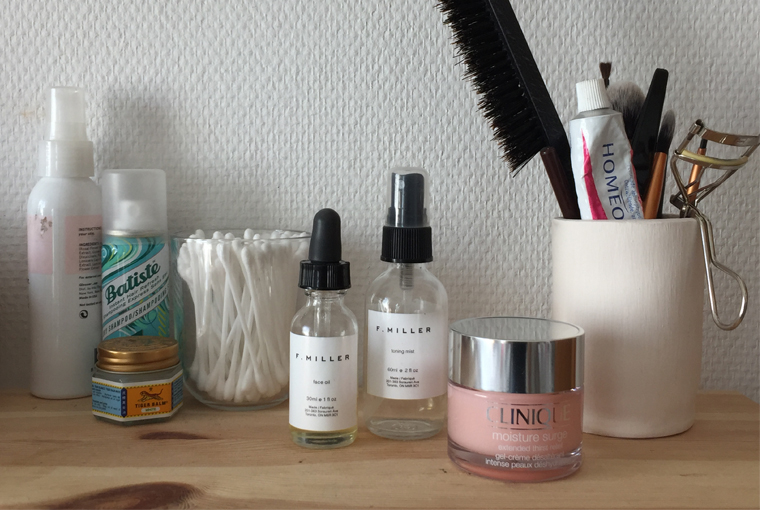
At what (x,y) coordinates should I click in order to perform the action: click on wooden table top surace. Please return your answer as a coordinate pair (x, y). The image size is (760, 510). Looking at the image, I should click on (306, 491).